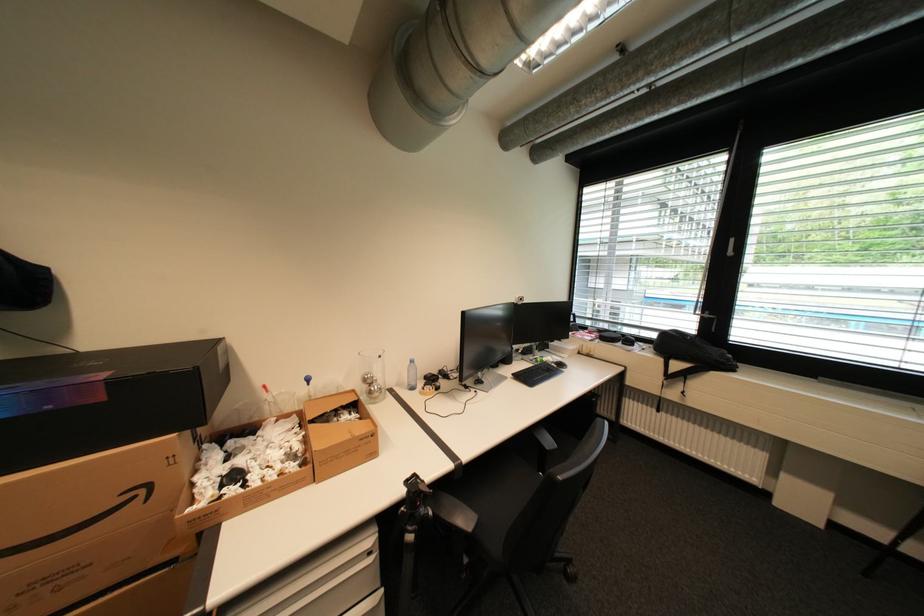
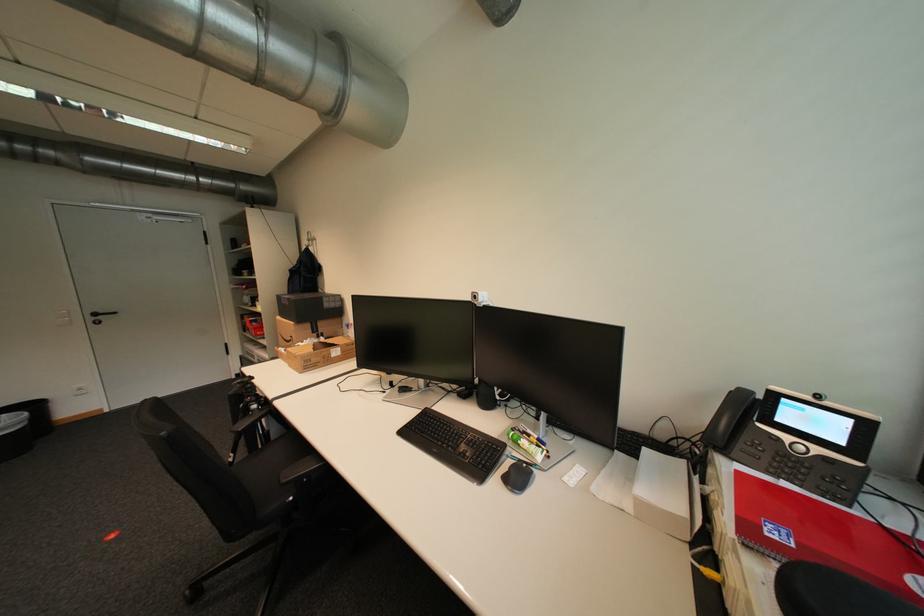
Locate, in the second image, the point that corresponds to (x=130, y=495) in the first image.

(299, 338)